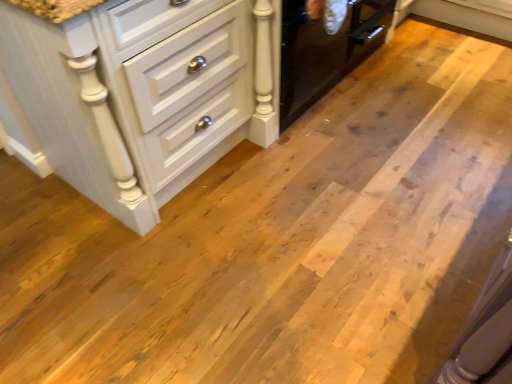
At what (x,y) coordinates should I click in order to perform the action: click on free space to the right of white painted wood chest of drawers at left. Please return your answer as a coordinate pair (x, y). Looking at the image, I should click on (329, 183).